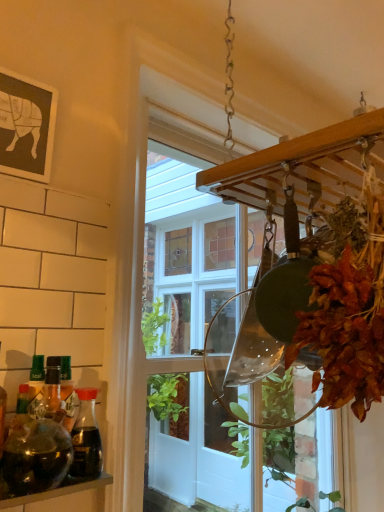
At what (x,y) coordinates should I click in order to perform the action: click on translucent glass bottle at left, which is the 1th bottle from back to front. Please return your answer as a coordinate pair (x, y). Image resolution: width=384 pixels, height=512 pixels. Looking at the image, I should click on (86, 437).

Identify the location of translucent glass bottle at left, which ranks as the 2th bottle in back-to-front order. This screenshot has width=384, height=512. (37, 452).

How much space does translucent glass bottle at left, which ranks as the 2th bottle in back-to-front order, occupy vertically?

translucent glass bottle at left, which ranks as the 2th bottle in back-to-front order, is 13.82 centimeters in height.

Find the location of a particular element. The width and height of the screenshot is (384, 512). translucent glass bottle at left, the second bottle viewed from the front is located at coordinates (x=86, y=437).

From a real-world perspective, which object rests below the other?

translucent glass bottle at left, which is the 1th bottle from back to front, from a real-world perspective.

The width and height of the screenshot is (384, 512). What are the coordinates of `bottle that is above the translucent glass bottle at left, which is the 1th bottle from back to front (from a real-world perspective)` in the screenshot? It's located at (37, 452).

Is point (101, 454) in front of point (61, 420)?

No, it is not.

Considering the relative sizes of translucent glass bottle at left, which is the 1th bottle from back to front, and translucent glass bottle at left, the 1th bottle in the front-to-back sequence, in the image provided, is translucent glass bottle at left, which is the 1th bottle from back to front, smaller than translucent glass bottle at left, the 1th bottle in the front-to-back sequence,?

Correct, translucent glass bottle at left, which is the 1th bottle from back to front, occupies less space than translucent glass bottle at left, the 1th bottle in the front-to-back sequence.

Based on their sizes in the image, would you say transparent glass jar at lower left is bigger or smaller than clear glass window at center?

transparent glass jar at lower left is smaller than clear glass window at center.

Is transparent glass jar at lower left far from clear glass window at center?

Yes, transparent glass jar at lower left is far from clear glass window at center.

Which object is wider, transparent glass jar at lower left or clear glass window at center?

Wider between the two is clear glass window at center.

Is translucent glass bottle at left, the 1th bottle in the front-to-back sequence, oriented away from transparent glass jar at lower left?

translucent glass bottle at left, the 1th bottle in the front-to-back sequence, does not have its back to transparent glass jar at lower left.

Is translucent glass bottle at left, the 1th bottle in the front-to-back sequence, further to the viewer compared to transparent glass jar at lower left?

Yes, translucent glass bottle at left, the 1th bottle in the front-to-back sequence, is further from the viewer.

Considering the sizes of objects translucent glass bottle at left, which ranks as the 2th bottle in back-to-front order, and transparent glass jar at lower left in the image provided, who is thinner, translucent glass bottle at left, which ranks as the 2th bottle in back-to-front order, or transparent glass jar at lower left?

translucent glass bottle at left, which ranks as the 2th bottle in back-to-front order.

Is translucent glass bottle at left, the 1th bottle in the front-to-back sequence, beside transparent glass jar at lower left?

Yes, translucent glass bottle at left, the 1th bottle in the front-to-back sequence, and transparent glass jar at lower left clearly make contact.

How many degrees apart are the facing directions of clear glass window at center and transparent glass jar at lower left?

There is a 15.3-degree angle between the facing directions of clear glass window at center and transparent glass jar at lower left.

The height and width of the screenshot is (512, 384). Find the location of `shelf lying below the clear glass window at center (from the image's perspective)`. shelf lying below the clear glass window at center (from the image's perspective) is located at coordinates (57, 492).

Does clear glass window at center come in front of transparent glass jar at lower left?

No, it is behind transparent glass jar at lower left.

Which is more to the left, clear glass window at center or transparent glass jar at lower left?

transparent glass jar at lower left is more to the left.

Measure the distance between translucent glass bottle at left, the 1th bottle in the front-to-back sequence, and clear glass window at center.

translucent glass bottle at left, the 1th bottle in the front-to-back sequence, is 3.47 meters away from clear glass window at center.

How many degrees apart are the facing directions of translucent glass bottle at left, which ranks as the 2th bottle in back-to-front order, and clear glass window at center?

The facing directions of translucent glass bottle at left, which ranks as the 2th bottle in back-to-front order, and clear glass window at center are 16.6 degrees apart.

Which is further, (17, 420) or (209, 402)?

Point (209, 402)

Can we say translucent glass bottle at left, which ranks as the 2th bottle in back-to-front order, lies outside clear glass window at center?

Yes, translucent glass bottle at left, which ranks as the 2th bottle in back-to-front order, is outside of clear glass window at center.

How many degrees apart are the facing directions of transparent glass jar at lower left and translucent glass bottle at left, the 1th bottle in the front-to-back sequence?

The angle between the facing direction of transparent glass jar at lower left and the facing direction of translucent glass bottle at left, the 1th bottle in the front-to-back sequence, is 1.28 degrees.

Considering the sizes of objects transparent glass jar at lower left and translucent glass bottle at left, the 1th bottle in the front-to-back sequence, in the image provided, who is wider, transparent glass jar at lower left or translucent glass bottle at left, the 1th bottle in the front-to-back sequence,?

transparent glass jar at lower left.

From a real-world perspective, is transparent glass jar at lower left positioned under translucent glass bottle at left, which ranks as the 2th bottle in back-to-front order, based on gravity?

Yes, from a real-world perspective, transparent glass jar at lower left is under translucent glass bottle at left, which ranks as the 2th bottle in back-to-front order.

Could you measure the distance between transparent glass jar at lower left and translucent glass bottle at left, which ranks as the 2th bottle in back-to-front order?

They are 2.42 inches apart.

Which object is thinner, translucent glass bottle at left, the 1th bottle in the front-to-back sequence, or translucent glass bottle at left, the second bottle viewed from the front?

Thinner between the two is translucent glass bottle at left, the second bottle viewed from the front.

Considering the positions of objects translucent glass bottle at left, which ranks as the 2th bottle in back-to-front order, and translucent glass bottle at left, the second bottle viewed from the front, in the image provided, who is in front, translucent glass bottle at left, which ranks as the 2th bottle in back-to-front order, or translucent glass bottle at left, the second bottle viewed from the front,?

Positioned in front is translucent glass bottle at left, which ranks as the 2th bottle in back-to-front order.

Could you measure the distance between translucent glass bottle at left, which ranks as the 2th bottle in back-to-front order, and translucent glass bottle at left, the second bottle viewed from the front?

They are 2.31 inches apart.

Is point (25, 467) behind point (76, 453)?

Yes, point (25, 467) is behind point (76, 453).

Locate an element on the screen. Image resolution: width=384 pixels, height=512 pixels. bottle behind the translucent glass bottle at left, which ranks as the 2th bottle in back-to-front order is located at coordinates (86, 437).

In the image, there is a transparent glass jar at lower left. At what (x,y) coordinates should I click in order to perform the action: click on window above it (from the image's perspective). Please return your answer as a coordinate pair (x, y). Looking at the image, I should click on (186, 249).

Estimate the real-world distances between objects in this image. Which object is closer to transparent glass jar at lower left, translucent glass bottle at left, which ranks as the 2th bottle in back-to-front order, or translucent glass bottle at left, which is the 1th bottle from back to front?

Based on the image, translucent glass bottle at left, which ranks as the 2th bottle in back-to-front order, appears to be nearer to transparent glass jar at lower left.

Looking at the image, which one is located further to transparent glass jar at lower left, clear glass window at center or translucent glass bottle at left, which is the 1th bottle from back to front?

The object further to transparent glass jar at lower left is clear glass window at center.

Estimate the real-world distances between objects in this image. Which object is further from transparent glass jar at lower left, translucent glass bottle at left, the second bottle viewed from the front, or clear glass window at center?

The object further to transparent glass jar at lower left is clear glass window at center.

Considering their positions, is translucent glass bottle at left, the second bottle viewed from the front, positioned closer to translucent glass bottle at left, which ranks as the 2th bottle in back-to-front order, than clear glass window at center?

The object closer to translucent glass bottle at left, which ranks as the 2th bottle in back-to-front order, is translucent glass bottle at left, the second bottle viewed from the front.

Considering their positions, is clear glass window at center positioned closer to transparent glass jar at lower left than translucent glass bottle at left, the 1th bottle in the front-to-back sequence?

translucent glass bottle at left, the 1th bottle in the front-to-back sequence, is positioned closer to the anchor transparent glass jar at lower left.

Considering their positions, is translucent glass bottle at left, which ranks as the 2th bottle in back-to-front order, positioned further to transparent glass jar at lower left than clear glass window at center?

Based on the image, clear glass window at center appears to be further to transparent glass jar at lower left.

Estimate the real-world distances between objects in this image. Which object is further from clear glass window at center, translucent glass bottle at left, the second bottle viewed from the front, or transparent glass jar at lower left?

Based on the image, transparent glass jar at lower left appears to be further to clear glass window at center.

When comparing their distances from clear glass window at center, does translucent glass bottle at left, which ranks as the 2th bottle in back-to-front order, or translucent glass bottle at left, the second bottle viewed from the front, seem further?

Based on the image, translucent glass bottle at left, which ranks as the 2th bottle in back-to-front order, appears to be further to clear glass window at center.

Locate an element on the screen. The image size is (384, 512). bottle positioned between transparent glass jar at lower left and translucent glass bottle at left, which is the 1th bottle from back to front, from near to far is located at coordinates (37, 452).

You are a GUI agent. You are given a task and a screenshot of the screen. Output one action in this format:
    pyautogui.click(x=<x>, y=<y>)
    Task: Click on the bottle between translucent glass bottle at left, which ranks as the 2th bottle in back-to-front order, and clear glass window at center
    
    Given the screenshot: What is the action you would take?
    pyautogui.click(x=86, y=437)